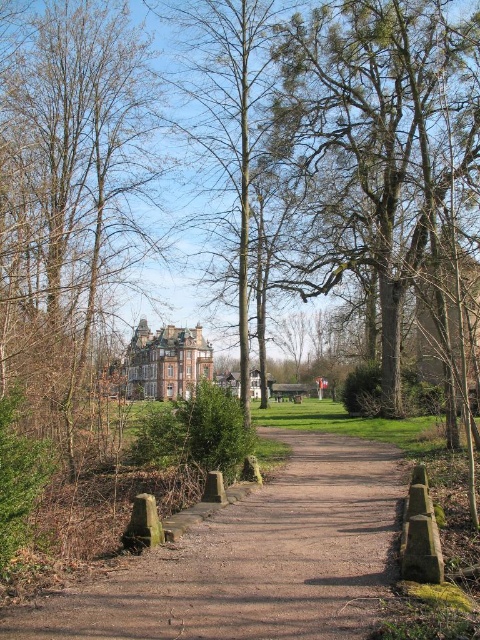
You are standing at point (253, 561) in the park. What is the terrain like under your feet?

The terrain at point (253, 561) is dirt and gravel path at center.